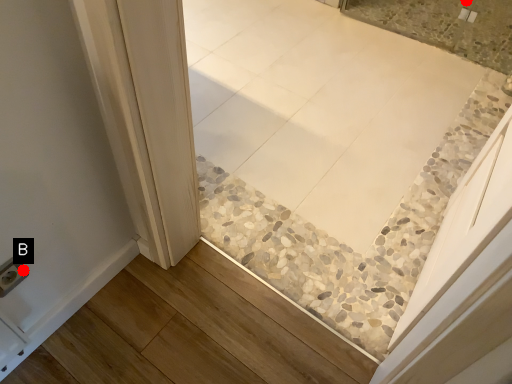
Question: Two points are circled on the image, labeled by A and B beside each circle. Among these points, which one is nearest to the camera?

Choices:
 (A) A is closer
 (B) B is closer

Answer: (B)